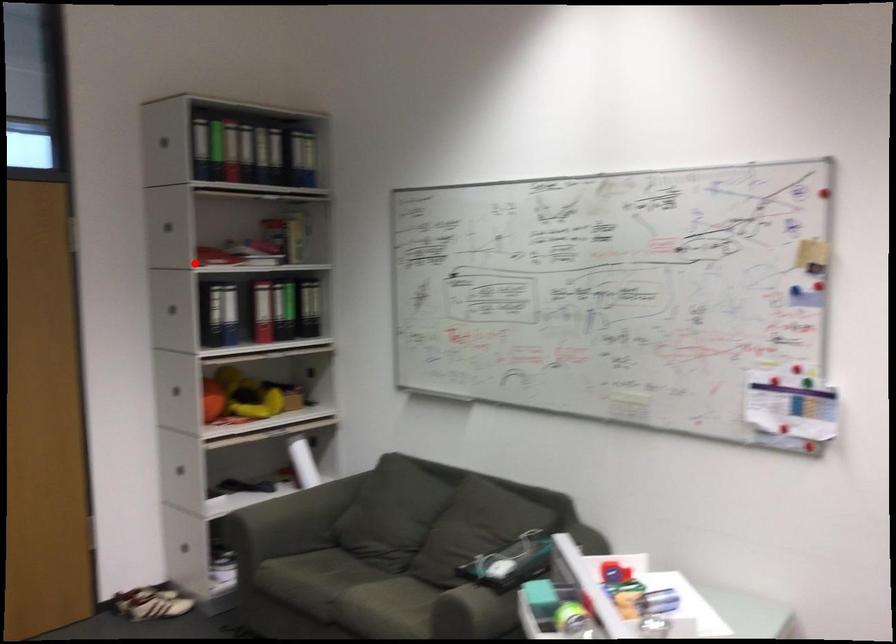
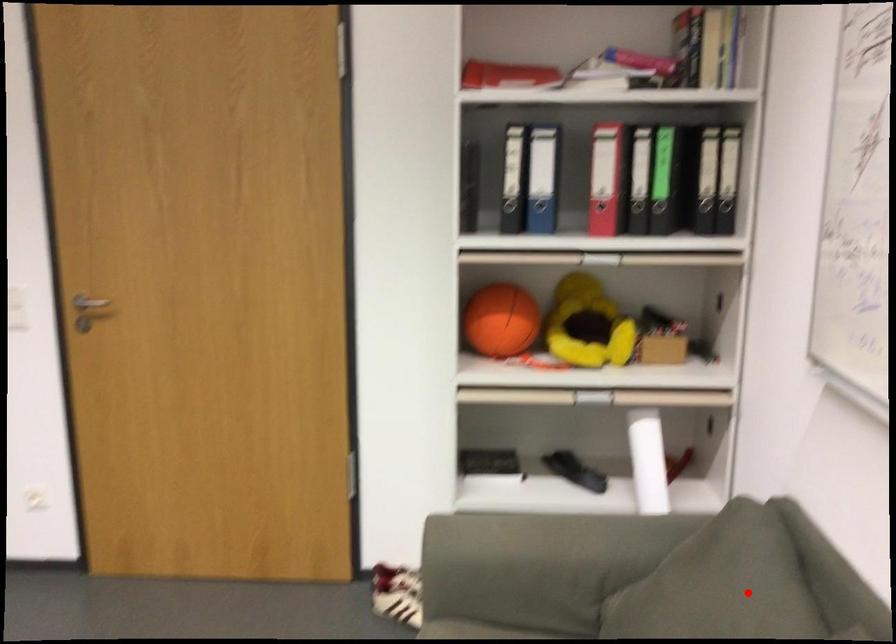
I am providing you with two images of the same scene from different viewpoints. A red point is marked on the first image and another point is marked on the second image. Does the point marked in image1 correspond to the same location as the one in image2?

No